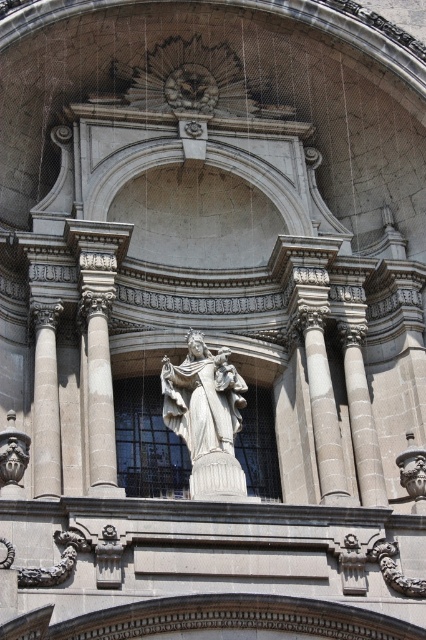
What is located at the point with coordinates (206, 417) in the classical architectural facade?

The point at (206, 417) is where the white marble statue at center is located.

Based on the scene description, which object is shorter between the white marble statue at center and the gray stone column at center?

The white marble statue at center is shorter than the gray stone column at center.

You are an architect analyzing the classical facade. There is a point at coordinates (206, 417). Which object from the scene does this point belong to?

The point at coordinates (206, 417) is on the white marble statue at center.